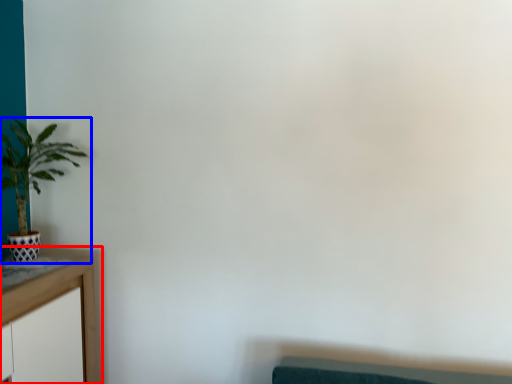
Question: Which object is further to the camera taking this photo, table (highlighted by a red box) or houseplant (highlighted by a blue box)?

Choices:
 (A) table
 (B) houseplant

Answer: (B)